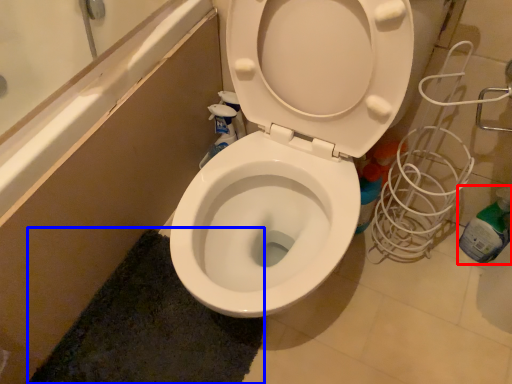
Question: Which object appears closest to the camera in this image, bottle (highlighted by a red box) or bath mat (highlighted by a blue box)?

Choices:
 (A) bottle
 (B) bath mat

Answer: (B)